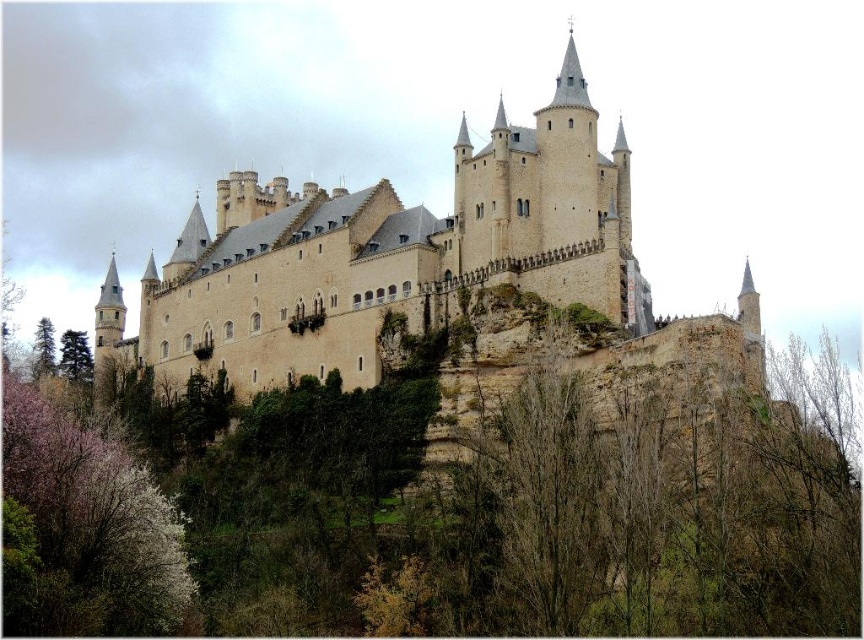
Question: Does pink blossoming branches at lower left have a lesser width compared to green matte tree at lower left?

Choices:
 (A) no
 (B) yes

Answer: (B)

Question: Which point is farther from the camera taking this photo?

Choices:
 (A) (36, 340)
 (B) (140, 589)

Answer: (A)

Question: Can you confirm if pink blossoming branches at lower left is bigger than green matte tree at lower left?

Choices:
 (A) no
 (B) yes

Answer: (A)

Question: Is pink blossoming branches at lower left to the right of green matte tree at lower left from the viewer's perspective?

Choices:
 (A) yes
 (B) no

Answer: (A)